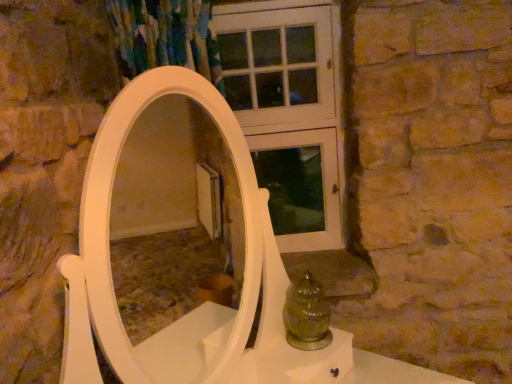
Question: Is white wooden screen door at upper center in front of or behind amber glass jar at lower center in the image?

Choices:
 (A) behind
 (B) front

Answer: (A)

Question: From a real-world perspective, is white wooden screen door at upper center above or below amber glass jar at lower center?

Choices:
 (A) above
 (B) below

Answer: (A)

Question: From the image's perspective, is white wooden screen door at upper center above or below amber glass jar at lower center?

Choices:
 (A) above
 (B) below

Answer: (A)

Question: Considering the positions of amber glass jar at lower center and white wooden screen door at upper center in the image, is amber glass jar at lower center wider or thinner than white wooden screen door at upper center?

Choices:
 (A) wide
 (B) thin

Answer: (A)

Question: From a real-world perspective, is amber glass jar at lower center positioned above or below white wooden screen door at upper center?

Choices:
 (A) below
 (B) above

Answer: (A)

Question: In the image, is amber glass jar at lower center positioned in front of or behind white wooden screen door at upper center?

Choices:
 (A) front
 (B) behind

Answer: (A)

Question: Would you say amber glass jar at lower center is inside or outside white wooden screen door at upper center?

Choices:
 (A) inside
 (B) outside

Answer: (B)